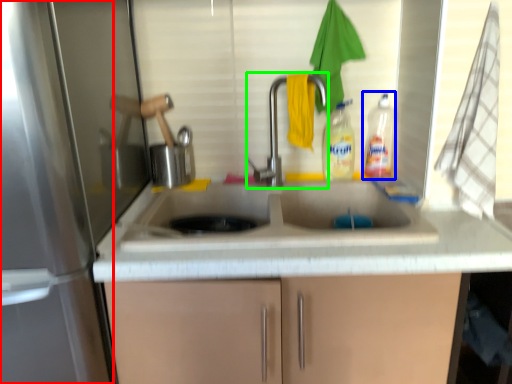
Question: Considering the real-world distances, which object is farthest from screen door (highlighted by a red box)? bottle (highlighted by a blue box) or tap (highlighted by a green box)?

Choices:
 (A) bottle
 (B) tap

Answer: (A)